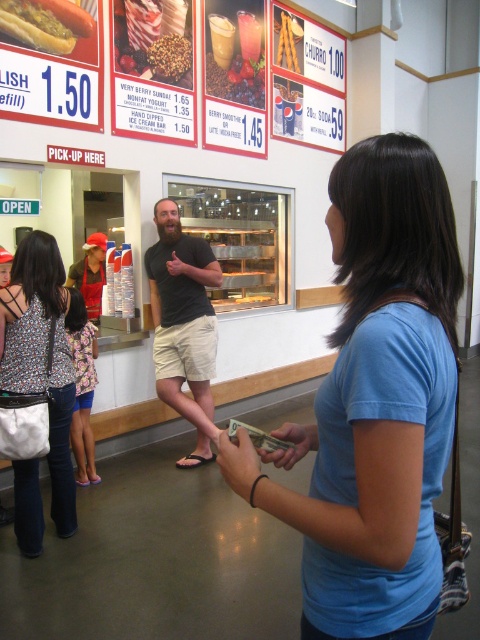
You are standing in the shop and want to know which of the two points, point (32,493) or point (4,13), is closer to you. Based on the scene description, which point is nearer?

Point (32,493) is closer to the camera than point (4,13), so it is nearer to you.

You are a customer at the shop and want to grab the smoothie cup at center and the red cap at left. Which item is located higher from the ground?

The smoothie cup at center is above the red cap at left, so it is higher from the ground.